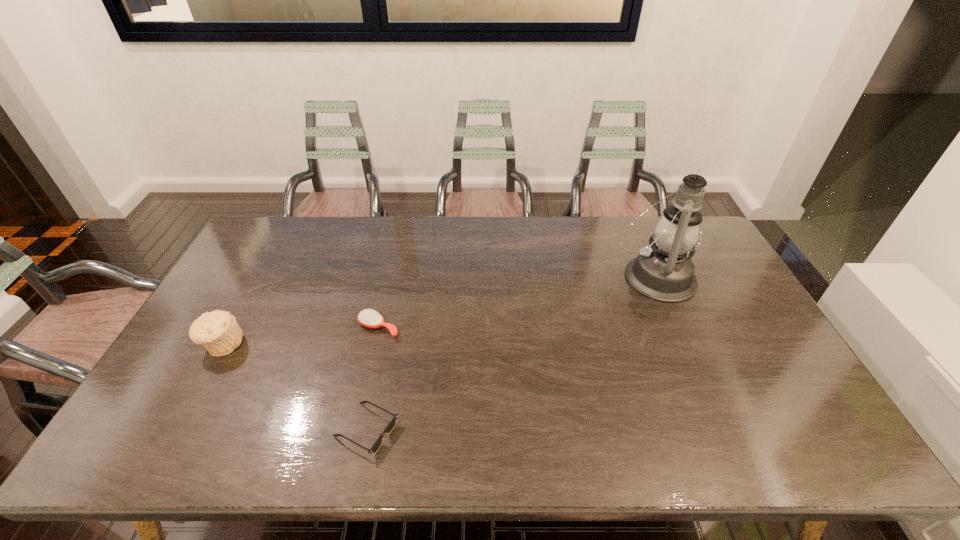
Where is `vacant area between the second shortest object and the rightmost object`? The width and height of the screenshot is (960, 540). vacant area between the second shortest object and the rightmost object is located at coordinates (516, 302).

At what (x,y) coordinates should I click in order to perform the action: click on vacant area between the shortest object and the tallest object. Please return your answer as a coordinate pair (x, y). The image size is (960, 540). Looking at the image, I should click on (511, 354).

Point out which object is positioned as the second nearest to the leftmost object. Please provide its 2D coordinates. Your answer should be formatted as a tuple, i.e. [(x, y)], where the tuple contains the x and y coordinates of a point satisfying the conditions above.

[(391, 425)]

This screenshot has width=960, height=540. I want to click on object that is the third nearest to the hairbrush, so click(x=664, y=271).

Find the location of `vacant space that satisfies the following two spatial constraints: 1. on the front side of the oil lamp; 2. on the lenses of the shortest object`. vacant space that satisfies the following two spatial constraints: 1. on the front side of the oil lamp; 2. on the lenses of the shortest object is located at coordinates (721, 430).

I want to click on free space that satisfies the following two spatial constraints: 1. on the back side of the hairbrush; 2. on the left side of the second tallest object, so click(x=232, y=328).